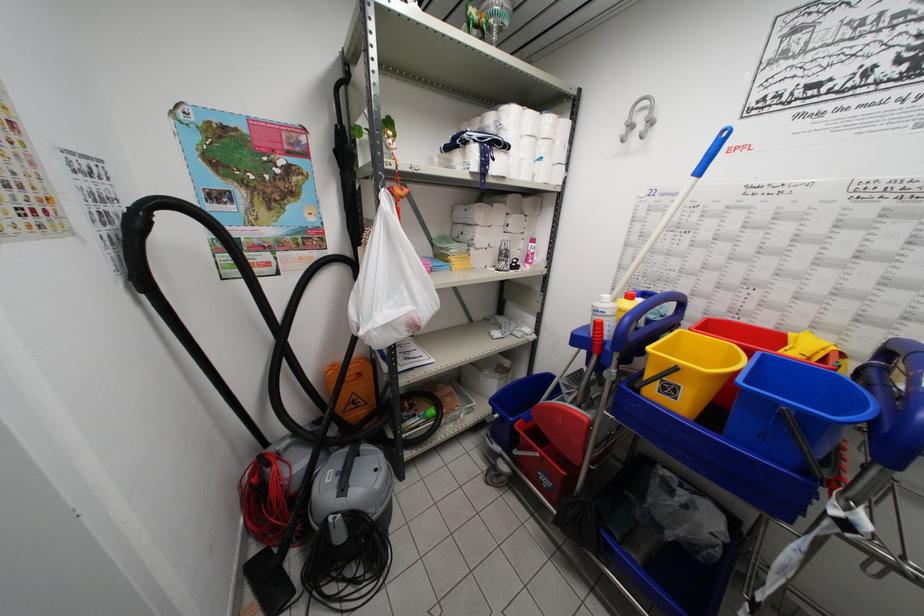
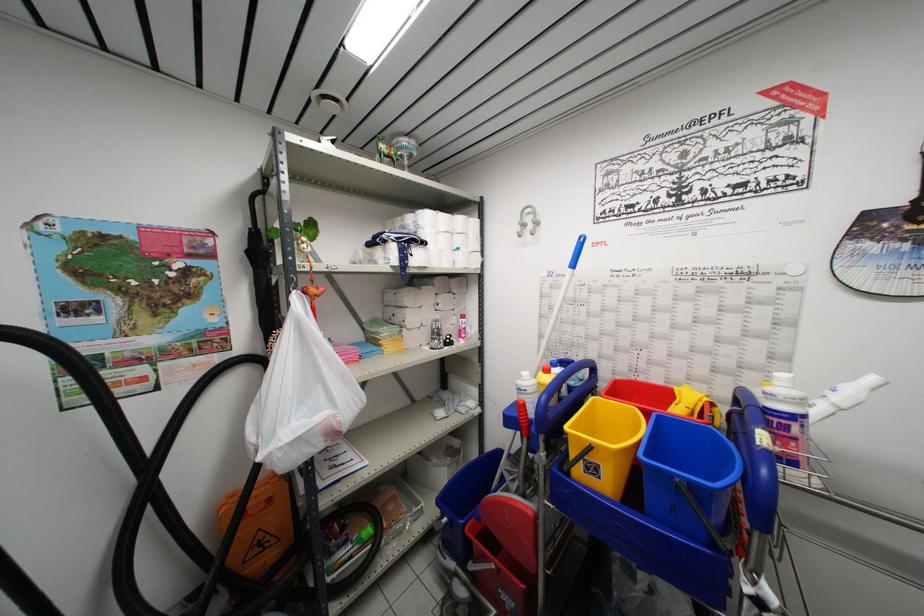
In the second image, find the point that corresponds to (606,338) in the first image.

(530, 419)